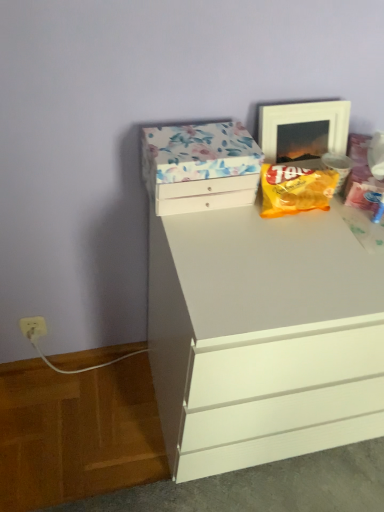
Image resolution: width=384 pixels, height=512 pixels. I want to click on white glossy picture frame at upper right, so click(303, 129).

This screenshot has width=384, height=512. Find the location of `white plastic electric outlet at lower left`. white plastic electric outlet at lower left is located at coordinates (33, 327).

I want to click on floral paper-covered box at upper center, so click(x=200, y=166).

Considering the relative sizes of white matte chest of drawers at center and yellow matte snack packet at upper right in the image provided, is white matte chest of drawers at center shorter than yellow matte snack packet at upper right?

In fact, white matte chest of drawers at center may be taller than yellow matte snack packet at upper right.

Consider the image. From a real-world perspective, between white matte chest of drawers at center and yellow matte snack packet at upper right, who is vertically higher?

From a 3D spatial view, yellow matte snack packet at upper right is above.

In the image, is white matte chest of drawers at center on the left side or the right side of yellow matte snack packet at upper right?

white matte chest of drawers at center is to the right of yellow matte snack packet at upper right.

Is white matte chest of drawers at center aimed at yellow matte snack packet at upper right?

No, white matte chest of drawers at center does not turn towards yellow matte snack packet at upper right.

Considering the positions of points (329, 111) and (269, 325), is point (329, 111) farther from camera compared to point (269, 325)?

That is True.

From the image's perspective, is white glossy picture frame at upper right over white matte chest of drawers at center?

→ Yes, from the image's perspective, white glossy picture frame at upper right is above white matte chest of drawers at center.

How much distance is there between white glossy picture frame at upper right and white matte chest of drawers at center?

white glossy picture frame at upper right is 18.89 inches from white matte chest of drawers at center.

Is white glossy picture frame at upper right smaller than white matte chest of drawers at center?

Yes.

Does floral paper-covered box at upper center turn towards white glossy picture frame at upper right?

No, floral paper-covered box at upper center does not turn towards white glossy picture frame at upper right.

In the image, is floral paper-covered box at upper center positioned in front of or behind white glossy picture frame at upper right?

In the image, floral paper-covered box at upper center appears in front of white glossy picture frame at upper right.

Locate an element on the screen. This screenshot has width=384, height=512. picture frame above the floral paper-covered box at upper center (from a real-world perspective) is located at coordinates (303, 129).

What are the coordinates of `snack that appears in front of the white glossy picture frame at upper right` in the screenshot? It's located at (295, 189).

Could you tell me if white glossy picture frame at upper right is facing yellow matte snack packet at upper right?

Yes, white glossy picture frame at upper right is turned towards yellow matte snack packet at upper right.

Is white glossy picture frame at upper right in contact with yellow matte snack packet at upper right?

white glossy picture frame at upper right and yellow matte snack packet at upper right are not in contact.

From a real-world perspective, who is located lower, white glossy picture frame at upper right or yellow matte snack packet at upper right?

In real-world perspective, yellow matte snack packet at upper right is lower.

Measure the distance between yellow matte snack packet at upper right and white plastic electric outlet at lower left.

They are 35.51 inches apart.

Considering the sizes of objects yellow matte snack packet at upper right and white plastic electric outlet at lower left in the image provided, who is taller, yellow matte snack packet at upper right or white plastic electric outlet at lower left?

yellow matte snack packet at upper right is taller.

Who is smaller, yellow matte snack packet at upper right or white plastic electric outlet at lower left?

With smaller size is white plastic electric outlet at lower left.

Does yellow matte snack packet at upper right lie in front of white plastic electric outlet at lower left?

Yes, yellow matte snack packet at upper right is in front of white plastic electric outlet at lower left.

From a real-world perspective, is white plastic electric outlet at lower left physically located above or below white matte chest of drawers at center?

In terms of real-world spatial position, white plastic electric outlet at lower left is below white matte chest of drawers at center.

Is white plastic electric outlet at lower left facing away from white matte chest of drawers at center?

No, white matte chest of drawers at center is not at the back of white plastic electric outlet at lower left.

From the image's perspective, is white plastic electric outlet at lower left located above white matte chest of drawers at center?

No.

Looking at the image, does white glossy picture frame at upper right seem bigger or smaller compared to floral paper-covered box at upper center?

Considering their sizes, white glossy picture frame at upper right takes up less space than floral paper-covered box at upper center.

Can you confirm if white glossy picture frame at upper right is shorter than floral paper-covered box at upper center?

No.

Does white glossy picture frame at upper right have a lesser width compared to floral paper-covered box at upper center?

Correct, the width of white glossy picture frame at upper right is less than that of floral paper-covered box at upper center.

Find the location of a particular element. The height and width of the screenshot is (512, 384). chest of drawers on the right of yellow matte snack packet at upper right is located at coordinates (262, 337).

You are a GUI agent. You are given a task and a screenshot of the screen. Output one action in this format:
    pyautogui.click(x=<x>, y=<y>)
    Task: Click on the chest of drawers located underneath the white glossy picture frame at upper right (from a real-world perspective)
    The width and height of the screenshot is (384, 512).
    Given the screenshot: What is the action you would take?
    pyautogui.click(x=262, y=337)

Estimate the real-world distances between objects in this image. Which object is further from white glossy picture frame at upper right, floral paper-covered box at upper center or white plastic electric outlet at lower left?

white plastic electric outlet at lower left.

When comparing their distances from white matte chest of drawers at center, does yellow matte snack packet at upper right or floral paper-covered box at upper center seem further?

yellow matte snack packet at upper right.

From the image, which object appears to be farther from white matte chest of drawers at center, floral paper-covered box at upper center or yellow matte snack packet at upper right?

yellow matte snack packet at upper right is further to white matte chest of drawers at center.

Estimate the real-world distances between objects in this image. Which object is closer to white plastic electric outlet at lower left, white glossy picture frame at upper right or floral paper-covered box at upper center?

floral paper-covered box at upper center is closer to white plastic electric outlet at lower left.

In the scene shown: Based on their spatial positions, is yellow matte snack packet at upper right or floral paper-covered box at upper center further from white glossy picture frame at upper right?

The object further to white glossy picture frame at upper right is floral paper-covered box at upper center.

Based on their spatial positions, is white matte chest of drawers at center or yellow matte snack packet at upper right further from white glossy picture frame at upper right?

white matte chest of drawers at center.

Based on the photo, from the image, which object appears to be farther from white plastic electric outlet at lower left, white matte chest of drawers at center or floral paper-covered box at upper center?

white matte chest of drawers at center is positioned further to the anchor white plastic electric outlet at lower left.

Estimate the real-world distances between objects in this image. Which object is further from floral paper-covered box at upper center, yellow matte snack packet at upper right or white plastic electric outlet at lower left?

The object further to floral paper-covered box at upper center is white plastic electric outlet at lower left.

Identify the location of snack between white plastic electric outlet at lower left and white matte chest of drawers at center in the horizontal direction. This screenshot has height=512, width=384. (295, 189).

Where is `snack that lies between floral paper-covered box at upper center and white matte chest of drawers at center from top to bottom`? snack that lies between floral paper-covered box at upper center and white matte chest of drawers at center from top to bottom is located at coordinates (295, 189).

You are a GUI agent. You are given a task and a screenshot of the screen. Output one action in this format:
    pyautogui.click(x=<x>, y=<y>)
    Task: Click on the storage box between white plastic electric outlet at lower left and white glossy picture frame at upper right in the horizontal direction
    This screenshot has height=512, width=384.
    Given the screenshot: What is the action you would take?
    pyautogui.click(x=200, y=166)

Where is `snack between white plastic electric outlet at lower left and white glossy picture frame at upper right`? This screenshot has width=384, height=512. snack between white plastic electric outlet at lower left and white glossy picture frame at upper right is located at coordinates (295, 189).